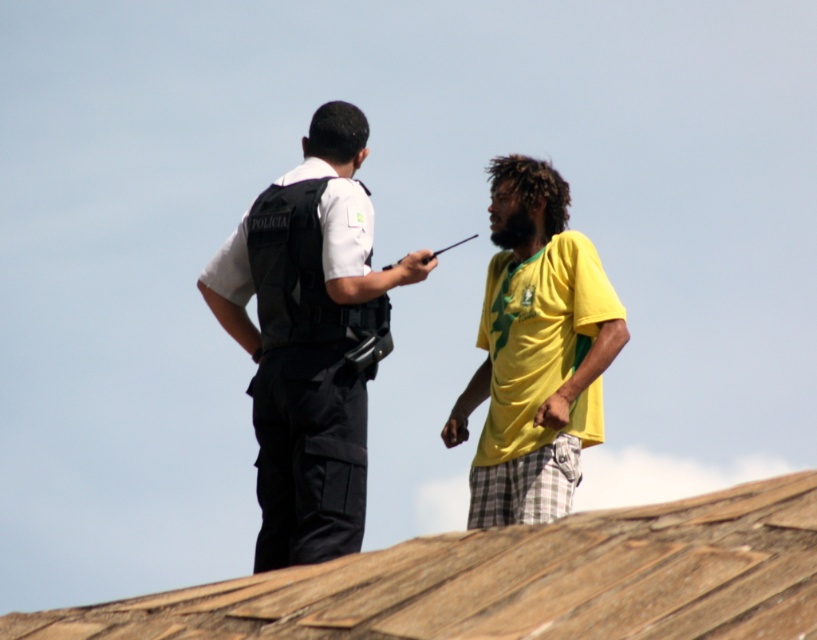
Question: Which point appears farthest from the camera in this image?

Choices:
 (A) (338, 545)
 (B) (534, 506)

Answer: (B)

Question: Is brown wooden roof at upper center below black uniformed officer at left?

Choices:
 (A) no
 (B) yes

Answer: (B)

Question: Does brown wooden roof at upper center have a larger size compared to black uniformed officer at left?

Choices:
 (A) yes
 (B) no

Answer: (A)

Question: Which object is the farthest from the black uniformed officer at left?

Choices:
 (A) brown wooden roof at upper center
 (B) yellow-green fabric shirt at center-right

Answer: (A)

Question: Considering the relative positions of brown wooden roof at upper center and yellow-green fabric shirt at center-right in the image provided, where is brown wooden roof at upper center located with respect to yellow-green fabric shirt at center-right?

Choices:
 (A) above
 (B) below

Answer: (B)

Question: Which point is farther from the camera taking this photo?

Choices:
 (A) (262, 460)
 (B) (586, 404)
 (C) (257, 584)

Answer: (B)